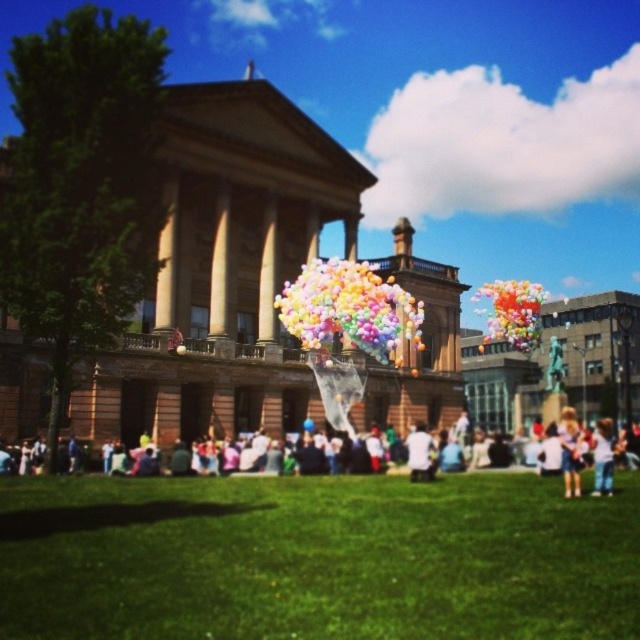
This screenshot has width=640, height=640. Describe the element at coordinates (513, 312) in the screenshot. I see `pastel balloons at upper center` at that location.

Measure the distance between point (518, 339) and camera.

Point (518, 339) and camera are 104.79 meters apart from each other.

At what (x,y) coordinates should I click in order to perform the action: click on pastel balloons at upper center. Please return your answer as a coordinate pair (x, y). The height and width of the screenshot is (640, 640). Looking at the image, I should click on (513, 312).

Is point (529, 310) more distant than point (605, 419)?

That is False.

Can you confirm if pastel balloons at upper center is positioned to the right of white cotton shirt at lower right?

No, pastel balloons at upper center is not to the right of white cotton shirt at lower right.

Which is in front, point (545, 292) or point (596, 422)?

Positioned in front is point (596, 422).

Find the location of `pastel balloons at upper center`. pastel balloons at upper center is located at coordinates (513, 312).

How far apart are white cotton shirt at lower right and white cotton shirt at center?

A distance of 16.82 meters exists between white cotton shirt at lower right and white cotton shirt at center.

Who is positioned more to the right, white cotton shirt at lower right or white cotton shirt at center?

white cotton shirt at lower right is more to the right.

Measure the distance between point (609, 419) and camera.

They are 358.56 feet apart.

Identify the location of white cotton shirt at lower right. (602, 458).